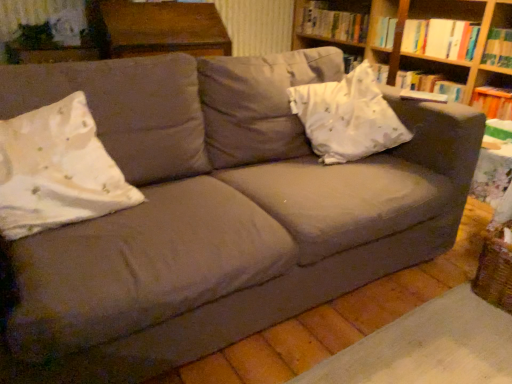
The image size is (512, 384). What do you see at coordinates (57, 170) in the screenshot? I see `white floral fabric pillow at left, placed as the second throw pillow when sorted from back to front` at bounding box center [57, 170].

Find the location of `white satin pillow at upper right, arranged as the 1th throw pillow when viewed from the right`. white satin pillow at upper right, arranged as the 1th throw pillow when viewed from the right is located at coordinates (347, 117).

Measure the distance between point (387, 134) and camera.

Point (387, 134) and camera are 5.64 feet apart.

Measure the distance between point (335, 31) and camera.

The depth of point (335, 31) is 10.23 feet.

What do you see at coordinates (440, 38) in the screenshot? I see `hardcover book at upper right, which is the 1th book from front to back` at bounding box center [440, 38].

This screenshot has height=384, width=512. In order to click on wooden bookshelf at upper right in this screenshot , I will do `click(421, 41)`.

You are a GUI agent. You are given a task and a screenshot of the screen. Output one action in this format:
    pyautogui.click(x=<x>, y=<y>)
    Task: Click on the wooden table at upper center
    The image size is (512, 384).
    Given the screenshot: What is the action you would take?
    pyautogui.click(x=157, y=28)

Locate an element on the screen. The width and height of the screenshot is (512, 384). white floral fabric pillow at left, the 2th throw pillow viewed from the right is located at coordinates (57, 170).

Looking at this image, which object is further away from the camera, hardcover book at upper right, which is the 1th book from front to back, or wooden table at upper center?

hardcover book at upper right, which is the 1th book from front to back, is more distant.

Considering the relative positions of hardcover book at upper right, which is the 1th book from front to back, and wooden table at upper center in the image provided, is hardcover book at upper right, which is the 1th book from front to back, to the left of wooden table at upper center from the viewer's perspective?

Incorrect, hardcover book at upper right, which is the 1th book from front to back, is not on the left side of wooden table at upper center.

Does hardcover book at upper right, the 2th book viewed from the back, have a greater height compared to wooden table at upper center?

In fact, hardcover book at upper right, the 2th book viewed from the back, may be shorter than wooden table at upper center.

From a real-world perspective, is hardcover book at upper right, which is the 1th book from front to back, on wooden table at upper center?

Yes, from a real-world perspective, hardcover book at upper right, which is the 1th book from front to back, is over wooden table at upper center

Looking at this image, would you consider wooden bookshelf at upper right to be distant from hardcover book at upper right, the 2th book viewed from the back?

No, wooden bookshelf at upper right is in close proximity to hardcover book at upper right, the 2th book viewed from the back.

Is wooden bookshelf at upper right further to camera compared to hardcover book at upper right, the 2th book viewed from the back?

No, it is in front of hardcover book at upper right, the 2th book viewed from the back.

Considering the points (459, 19) and (450, 38), which point is in front, point (459, 19) or point (450, 38)?

Positioned in front is point (459, 19).

From the image's perspective, relative to hardcover book at upper right, which is the 1th book from front to back, is wooden bookshelf at upper right above or below?

Based on their image positions, wooden bookshelf at upper right is located above hardcover book at upper right, which is the 1th book from front to back.

Is hardcover book at right completely or partially outside of wooden table at upper center?

hardcover book at right is positioned outside wooden table at upper center.

Based on the photo, is hardcover book at right looking in the opposite direction of wooden table at upper center?

No, hardcover book at right is not facing away from wooden table at upper center.

From a real-world perspective, is hardcover book at right located beneath wooden table at upper center?

Yes, from a real-world perspective, hardcover book at right is beneath wooden table at upper center.

Based on the photo, who is bigger, hardcover book at right or wooden table at upper center?

Bigger between the two is wooden table at upper center.

Locate an element on the screen. Image resolution: width=512 pixels, height=384 pixels. the 2nd throw pillow below the hardcover book at right (from the image's perspective) is located at coordinates (57, 170).

Can you confirm if white floral fabric pillow at left, which is the first throw pillow from front to back, is taller than hardcover book at right?

Correct, white floral fabric pillow at left, which is the first throw pillow from front to back, is much taller as hardcover book at right.

From the image's perspective, between white floral fabric pillow at left, which is counted as the 1th throw pillow, starting from the left, and hardcover book at right, who is located below?

white floral fabric pillow at left, which is counted as the 1th throw pillow, starting from the left, appears lower in the image.

Does white floral fabric pillow at left, which is the first throw pillow from front to back, appear on the right side of hardcover book at right?

No.

Is hardcover book at upper right, which ranks as the 1th book in back-to-front order, completely or partially outside of white floral fabric pillow at left, placed as the second throw pillow when sorted from back to front?

hardcover book at upper right, which ranks as the 1th book in back-to-front order, lies outside white floral fabric pillow at left, placed as the second throw pillow when sorted from back to front,'s area.

Which is more to the right, hardcover book at upper right, which ranks as the second book in front-to-back order, or white floral fabric pillow at left, which is the first throw pillow from front to back?

hardcover book at upper right, which ranks as the second book in front-to-back order, is more to the right.

Can you see hardcover book at upper right, which ranks as the 1th book in back-to-front order, touching white floral fabric pillow at left, placed as the second throw pillow when sorted from back to front?

hardcover book at upper right, which ranks as the 1th book in back-to-front order, and white floral fabric pillow at left, placed as the second throw pillow when sorted from back to front, are clearly separated.

Are white floral fabric pillow at left, which is the first throw pillow from front to back, and hardcover book at upper right, which ranks as the second book in front-to-back order, making contact?

white floral fabric pillow at left, which is the first throw pillow from front to back, and hardcover book at upper right, which ranks as the second book in front-to-back order, are clearly separated.

Measure the distance between white floral fabric pillow at left, which is the first throw pillow from front to back, and hardcover book at upper right, which ranks as the second book in front-to-back order.

The distance of white floral fabric pillow at left, which is the first throw pillow from front to back, from hardcover book at upper right, which ranks as the second book in front-to-back order, is 7.59 feet.

Is white floral fabric pillow at left, placed as the second throw pillow when sorted from back to front, aimed at hardcover book at upper right, which ranks as the second book in front-to-back order?

No, white floral fabric pillow at left, placed as the second throw pillow when sorted from back to front, is not aimed at hardcover book at upper right, which ranks as the second book in front-to-back order.

Where is `the 1st book to the right when counting from the white floral fabric pillow at left, which is counted as the 1th throw pillow, starting from the left`? The width and height of the screenshot is (512, 384). the 1st book to the right when counting from the white floral fabric pillow at left, which is counted as the 1th throw pillow, starting from the left is located at coordinates (333, 23).

From the hardcover book at upper right, which is the 1th book from front to back, count the 1st throw pillow to the left and point to it. Please provide its 2D coordinates.

[(347, 117)]

In terms of height, does white satin pillow at upper right, placed as the first throw pillow when sorted from back to front, look taller or shorter compared to hardcover book at upper right, the 2th book viewed from the back?

white satin pillow at upper right, placed as the first throw pillow when sorted from back to front, is taller than hardcover book at upper right, the 2th book viewed from the back.

Is white satin pillow at upper right, the 2th throw pillow viewed from the left, spatially inside hardcover book at upper right, which is the 1th book from front to back, or outside of it?

white satin pillow at upper right, the 2th throw pillow viewed from the left, is not inside hardcover book at upper right, which is the 1th book from front to back, it's outside.

Is there a large distance between white satin pillow at upper right, arranged as the 1th throw pillow when viewed from the right, and hardcover book at upper right, which is the 1th book from front to back?

No, white satin pillow at upper right, arranged as the 1th throw pillow when viewed from the right, is in close proximity to hardcover book at upper right, which is the 1th book from front to back.

The width and height of the screenshot is (512, 384). In order to click on table above the hardcover book at upper right, the 2th book viewed from the back (from the image's perspective) in this screenshot , I will do `click(157, 28)`.

Locate an element on the screen. This screenshot has height=384, width=512. book on the right side of wooden bookshelf at upper right is located at coordinates point(440,38).

Consider the image. Based on their spatial positions, is wooden table at upper center or white floral fabric pillow at left, the 2th throw pillow viewed from the right, further from hardcover book at right?

Based on the image, white floral fabric pillow at left, the 2th throw pillow viewed from the right, appears to be further to hardcover book at right.

Estimate the real-world distances between objects in this image. Which object is closer to wooden table at upper center, hardcover book at right or white satin pillow at upper right, the 2th throw pillow viewed from the left?

white satin pillow at upper right, the 2th throw pillow viewed from the left, is closer to wooden table at upper center.

Estimate the real-world distances between objects in this image. Which object is closer to wooden table at upper center, hardcover book at upper right, the 2th book viewed from the back, or hardcover book at right?

Based on the image, hardcover book at upper right, the 2th book viewed from the back, appears to be nearer to wooden table at upper center.

Estimate the real-world distances between objects in this image. Which object is closer to hardcover book at right, wooden table at upper center or wooden bookshelf at upper right?

The object closer to hardcover book at right is wooden bookshelf at upper right.

Estimate the real-world distances between objects in this image. Which object is closer to hardcover book at upper right, which is the 1th book from front to back, white satin pillow at upper right, placed as the first throw pillow when sorted from back to front, or hardcover book at upper right, which ranks as the 1th book in back-to-front order?

Answer: The object closer to hardcover book at upper right, which is the 1th book from front to back, is hardcover book at upper right, which ranks as the 1th book in back-to-front order.

From the image, which object appears to be nearer to white satin pillow at upper right, arranged as the 1th throw pillow when viewed from the right, wooden bookshelf at upper right or white floral fabric pillow at left, which is counted as the 1th throw pillow, starting from the left?

The object closer to white satin pillow at upper right, arranged as the 1th throw pillow when viewed from the right, is wooden bookshelf at upper right.

Looking at the image, which one is located further to hardcover book at upper right, which ranks as the second book in front-to-back order, hardcover book at upper right, which is the 1th book from front to back, or white floral fabric pillow at left, which is the first throw pillow from front to back?

Among the two, white floral fabric pillow at left, which is the first throw pillow from front to back, is located further to hardcover book at upper right, which ranks as the second book in front-to-back order.

When comparing their distances from wooden bookshelf at upper right, does white satin pillow at upper right, the second throw pillow when ordered from front to back, or white floral fabric pillow at left, placed as the second throw pillow when sorted from back to front, seem further?

The object further to wooden bookshelf at upper right is white floral fabric pillow at left, placed as the second throw pillow when sorted from back to front.

You are a GUI agent. You are given a task and a screenshot of the screen. Output one action in this format:
    pyautogui.click(x=<x>, y=<y>)
    Task: Click on the table located between white satin pillow at upper right, arranged as the 1th throw pillow when viewed from the right, and hardcover book at upper right, which ranks as the 1th book in back-to-front order, in the depth direction
    Image resolution: width=512 pixels, height=384 pixels.
    Given the screenshot: What is the action you would take?
    pyautogui.click(x=157, y=28)

Where is `shelf located between white satin pillow at upper right, the second throw pillow when ordered from front to back, and hardcover book at upper right, the 2th book viewed from the back, in the depth direction`? This screenshot has height=384, width=512. shelf located between white satin pillow at upper right, the second throw pillow when ordered from front to back, and hardcover book at upper right, the 2th book viewed from the back, in the depth direction is located at coordinates (421, 41).

This screenshot has height=384, width=512. I want to click on book between white satin pillow at upper right, placed as the first throw pillow when sorted from back to front, and hardcover book at upper right, which ranks as the second book in front-to-back order, along the z-axis, so (440, 38).

Identify the location of shelf between white floral fabric pillow at left, which is counted as the 1th throw pillow, starting from the left, and hardcover book at upper right, which ranks as the 1th book in back-to-front order, along the z-axis. The image size is (512, 384). (421, 41).